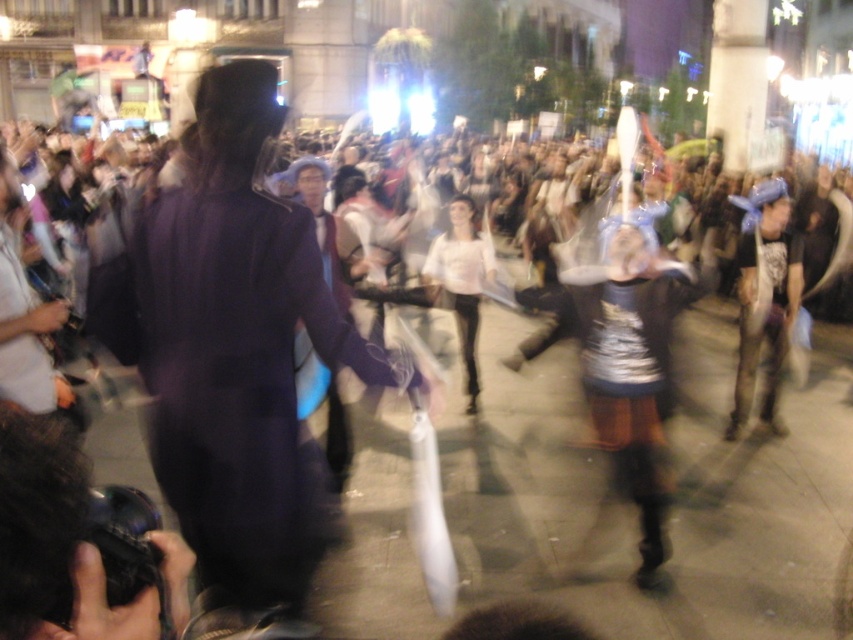
Question: Can you confirm if purple fabric coat at left is positioned to the right of metallic silver armor at center?

Choices:
 (A) no
 (B) yes

Answer: (A)

Question: Among these points, which one is farthest from the camera?

Choices:
 (A) (370, 364)
 (B) (488, 241)
 (C) (747, 320)

Answer: (B)

Question: Does camouflage-patterned pants at right come in front of white matte dress at center?

Choices:
 (A) no
 (B) yes

Answer: (A)

Question: Among these points, which one is farthest from the camera?

Choices:
 (A) (785, 298)
 (B) (173, 428)
 (C) (611, 260)

Answer: (A)

Question: Estimate the real-world distances between objects in this image. Which object is closer to the camouflage-patterned pants at right?

Choices:
 (A) purple fabric coat at left
 (B) metallic silver armor at center

Answer: (B)

Question: Where is metallic silver armor at center located in relation to white matte dress at center in the image?

Choices:
 (A) right
 (B) left

Answer: (A)